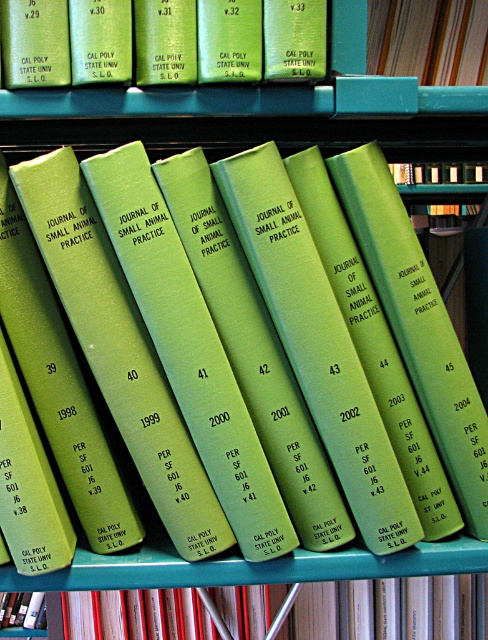
You are organizing books on a teal shelf. You have a green matte book at center and a green matte book at upper center. Which book requires more horizontal space when placed side by side?

The green matte book at center requires more horizontal space because its width is larger than the green matte book at upper center.

You are organizing books on a teal shelf and have two green books to place. The first is labeled as the matte green book at center and the second as the green matte book at upper center. Which book should you place lower on the shelf to maintain proper height order?

You should place the matte green book at center lower on the shelf because it is shorter than the green matte book at upper center, ensuring the taller book is positioned above.